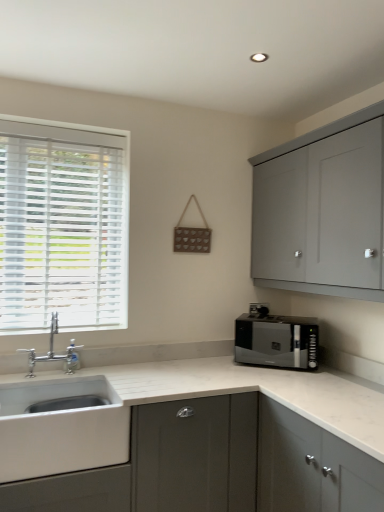
Question: Does white wood blinds at left touch silver metallic faucet at left?

Choices:
 (A) yes
 (B) no

Answer: (B)

Question: Is white wood blinds at left positioned with its back to silver metallic faucet at left?

Choices:
 (A) yes
 (B) no

Answer: (B)

Question: Is white wood blinds at left at the left side of silver metallic faucet at left?

Choices:
 (A) no
 (B) yes

Answer: (B)

Question: Is the depth of white wood blinds at left greater than that of silver metallic faucet at left?

Choices:
 (A) yes
 (B) no

Answer: (A)

Question: Would you say white wood blinds at left contains silver metallic faucet at left?

Choices:
 (A) no
 (B) yes

Answer: (A)

Question: Is white wood blinds at left shorter than silver metallic faucet at left?

Choices:
 (A) no
 (B) yes

Answer: (A)

Question: Is white ceramic sink at lower left further to camera compared to white wood blinds at left?

Choices:
 (A) no
 (B) yes

Answer: (A)

Question: Is white ceramic sink at lower left turned away from white wood blinds at left?

Choices:
 (A) no
 (B) yes

Answer: (A)

Question: Does white ceramic sink at lower left have a smaller size compared to white wood blinds at left?

Choices:
 (A) yes
 (B) no

Answer: (B)

Question: Can you confirm if white ceramic sink at lower left is wider than white wood blinds at left?

Choices:
 (A) yes
 (B) no

Answer: (A)

Question: Could you tell me if white ceramic sink at lower left is turned towards white wood blinds at left?

Choices:
 (A) no
 (B) yes

Answer: (A)

Question: Does white ceramic sink at lower left come in front of white wood blinds at left?

Choices:
 (A) yes
 (B) no

Answer: (A)

Question: Is white wood blinds at left outside matte gray cabinet at lower left, which appears as the first cabinetry when ordered from the bottom?

Choices:
 (A) no
 (B) yes

Answer: (B)